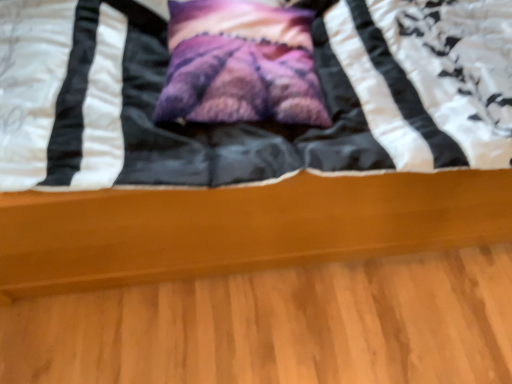
Identify the location of purple fabric pillow at center. (240, 64).

This screenshot has width=512, height=384. Describe the element at coordinates (240, 64) in the screenshot. I see `purple fabric pillow at center` at that location.

In order to face purple fabric pillow at center, should I rotate leftwards or rightwards?

Rotate left and turn 1.025 degrees.

Where is `purple fabric pillow at center`? This screenshot has height=384, width=512. purple fabric pillow at center is located at coordinates (240, 64).